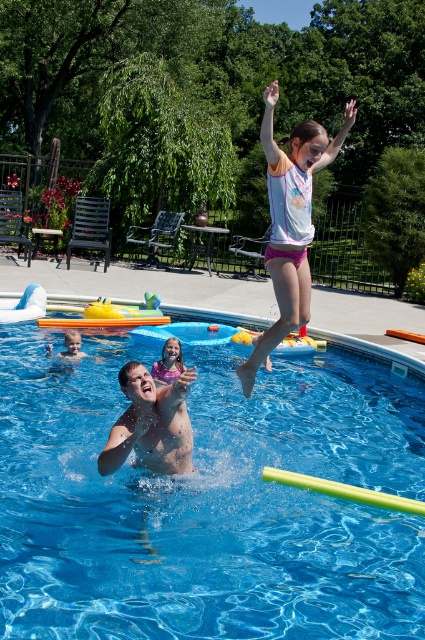
You are standing at the edge of the pool and want to jump in. There is a point at coordinates [169,362]. Is this point located on the pink shorts of the girl in the image?

Yes, the point at coordinates [169,362] is located on the matte pink shorts at upper center, which belong to the girl in the image.